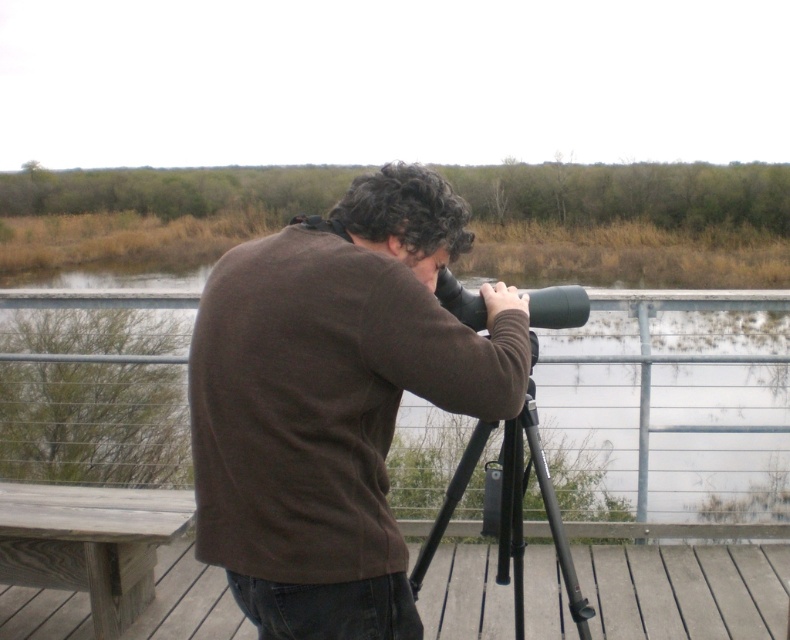
Does brown matte sweater at center appear on the left side of wooden at lower left?

Indeed, brown matte sweater at center is positioned on the left side of wooden at lower left.

Measure the distance between brown matte sweater at center and wooden at lower left.

brown matte sweater at center and wooden at lower left are 7.43 feet apart.

Which is behind, point (506, 394) or point (711, 611)?

Positioned behind is point (711, 611).

What are the coordinates of `brown matte sweater at center` in the screenshot? It's located at (333, 401).

The width and height of the screenshot is (790, 640). What do you see at coordinates (672, 410) in the screenshot? I see `clear water at center` at bounding box center [672, 410].

Can you confirm if clear water at center is thinner than black rubber binoculars at center?

In fact, clear water at center might be wider than black rubber binoculars at center.

Does point (577, 532) come behind point (533, 323)?

Yes.

Find the location of a particular element. This screenshot has width=790, height=640. clear water at center is located at coordinates (672, 410).

Which of these two, clear water at center or black matte tripod at center, stands shorter?

clear water at center is shorter.

Between clear water at center and black matte tripod at center, which one appears on the left side from the viewer's perspective?

black matte tripod at center is more to the left.

Locate an element on the screen. This screenshot has height=640, width=790. clear water at center is located at coordinates 672,410.

The image size is (790, 640). I want to click on clear water at center, so click(x=672, y=410).